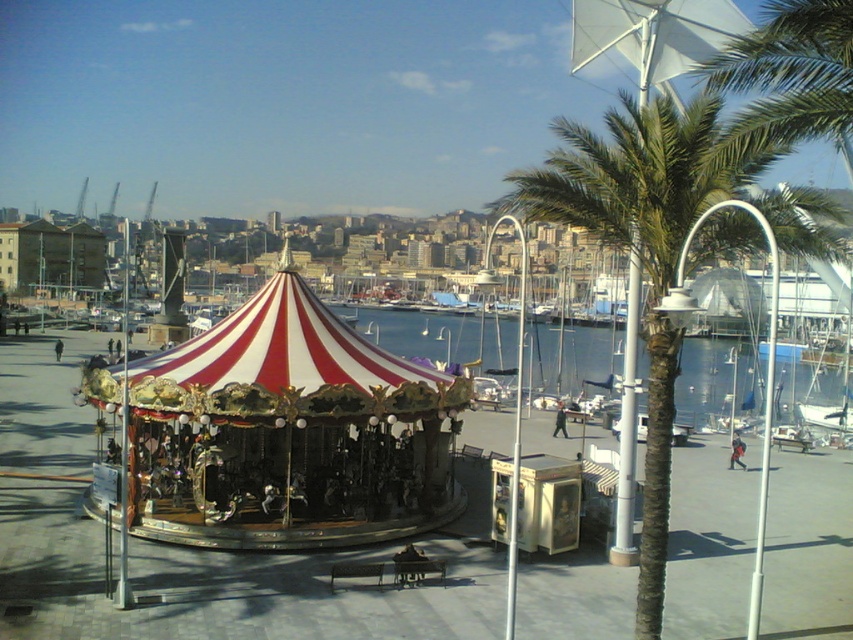
Looking at this image, you are planning to install a new lighting system for the carousel. The lighting fixture you have is 6 meters long. You need to place it between the red and white striped canopy at center and the metallic pole at center. Will the lighting fixture fit in the space between them?

The distance between the red and white striped canopy at center and the metallic pole at center is 7.12 meters. Since the lighting fixture is 6 meters long, it will fit in the space between them as 6 meters is shorter than 7.12 meters.

You are standing in the marina area and want to take a photo of both the green leafy palm tree at center and the red and white striped canopy at center. Which object should you position to your left to include both in the frame?

You should position the red and white striped canopy at center to your left, as the green leafy palm tree at center is on the right side of it.

You are planning to take a photo of the green leafy palm tree at center and the metallic pole at center from a distance. Which object will appear bigger in the photo?

The green leafy palm tree at center will appear bigger in the photo because it has a larger size compared to the metallic pole at center.